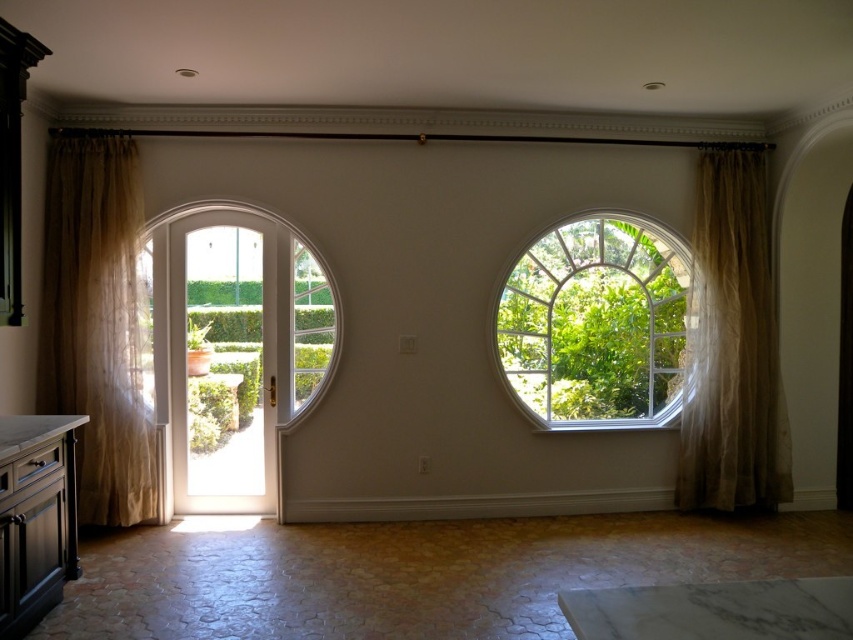
Who is higher up, clear glass window at center or sheer beige curtain at right?

sheer beige curtain at right is higher up.

You are a GUI agent. You are given a task and a screenshot of the screen. Output one action in this format:
    pyautogui.click(x=<x>, y=<y>)
    Task: Click on the clear glass window at center
    This screenshot has width=853, height=640.
    Given the screenshot: What is the action you would take?
    pyautogui.click(x=596, y=324)

What do you see at coordinates (596, 324) in the screenshot?
I see `clear glass window at center` at bounding box center [596, 324].

At what (x,y) coordinates should I click in order to perform the action: click on clear glass window at center. Please return your answer as a coordinate pair (x, y). Image resolution: width=853 pixels, height=640 pixels. Looking at the image, I should click on click(x=596, y=324).

Between point (109, 497) and point (517, 378), which one is positioned in front?

Point (109, 497) is in front.

Find the location of a particular element. sheer beige curtain at left is located at coordinates (97, 324).

Find the location of `sheer beige curtain at left`. sheer beige curtain at left is located at coordinates (97, 324).

Who is higher up, sheer beige curtain at left or sheer beige curtain at right?

sheer beige curtain at right is higher up.

Is sheer beige curtain at left to the right of sheer beige curtain at right from the viewer's perspective?

In fact, sheer beige curtain at left is to the left of sheer beige curtain at right.

Who is more forward, (54, 269) or (711, 195)?

Point (54, 269)

I want to click on sheer beige curtain at left, so click(97, 324).